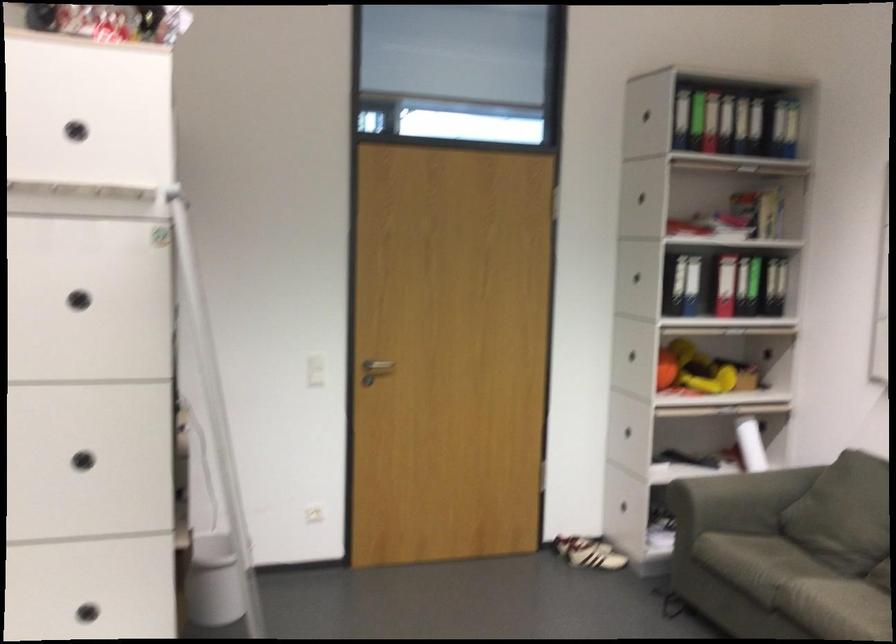
Where would you lift the red binder? Please return your answer as a coordinate pair (x, y).

(725, 285)